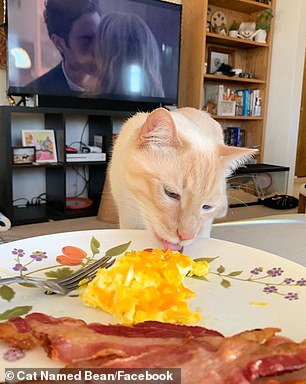
Locate an element on the screen. fork is located at coordinates (67, 282).